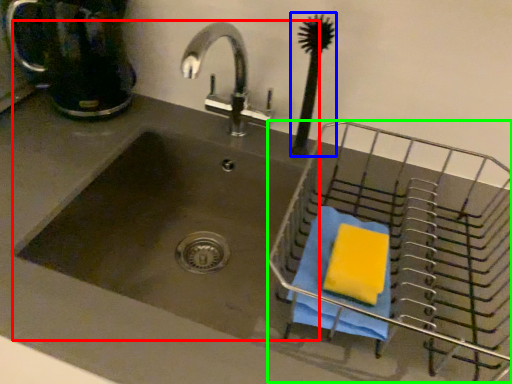
Question: Considering the real-world distances, which object is closest to sink (highlighted by a red box)? brush (highlighted by a blue box) or basket (highlighted by a green box).

Choices:
 (A) brush
 (B) basket

Answer: (B)